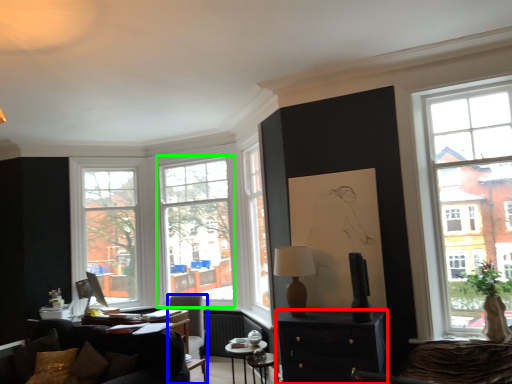
Question: Estimate the real-world distances between objects in this image. Which object is farther from cabinetry (highlighted by a red box), chair (highlighted by a blue box) or window (highlighted by a green box)?

Choices:
 (A) chair
 (B) window

Answer: (B)